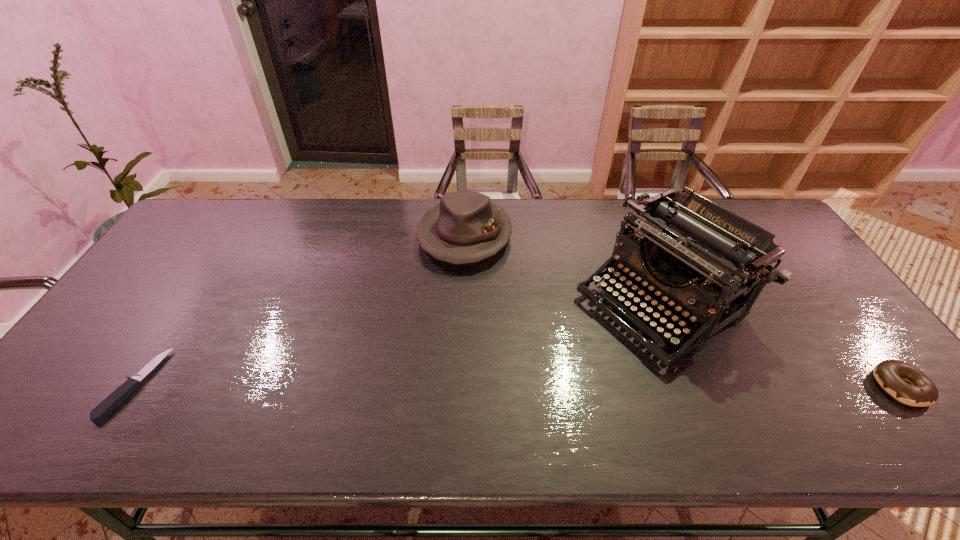
Find the location of a particular element. vacant area that lies between the second tallest object and the steak knife is located at coordinates (300, 310).

Find the location of a particular element. This screenshot has height=540, width=960. vacant area that lies between the third object from right to left and the typewriter is located at coordinates (563, 268).

Locate an element on the screen. The height and width of the screenshot is (540, 960). free space between the third tallest object and the shortest object is located at coordinates coord(517,386).

Identify the location of free spot between the hat and the shortest object. The width and height of the screenshot is (960, 540). (300, 310).

The height and width of the screenshot is (540, 960). I want to click on free point between the third object from right to left and the steak knife, so click(x=300, y=310).

Identify the location of free spot between the steak knife and the tallest object. (397, 343).

Locate an element on the screen. The width and height of the screenshot is (960, 540). free spot between the typewriter and the doughnut is located at coordinates (780, 344).

Identify the location of free point between the second tallest object and the tallest object. The height and width of the screenshot is (540, 960). (563, 268).

Point out which object is positioned as the third nearest to the leftmost object. Please provide its 2D coordinates. Your answer should be formatted as a tuple, i.e. [(x, y)], where the tuple contains the x and y coordinates of a point satisfying the conditions above.

[(920, 391)]

Where is `object that is the closest one to the rightmost object`? This screenshot has width=960, height=540. object that is the closest one to the rightmost object is located at coordinates (691, 249).